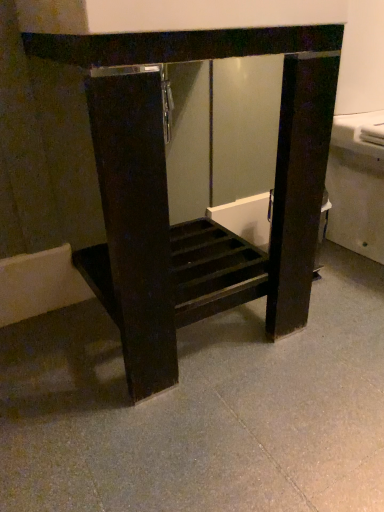
This screenshot has width=384, height=512. What do you see at coordinates (202, 410) in the screenshot?
I see `gray polished concrete at center` at bounding box center [202, 410].

Where is `gray polished concrete at center`? The height and width of the screenshot is (512, 384). gray polished concrete at center is located at coordinates (202, 410).

What is the approximate height of matte black cabinet at center?

It is 72.42 centimeters.

What do you see at coordinates (167, 192) in the screenshot?
I see `matte black cabinet at center` at bounding box center [167, 192].

Locate an element on the screen. This screenshot has height=512, width=384. matte black cabinet at center is located at coordinates (167, 192).

At what (x,y) coordinates should I click in order to perform the action: click on gray polished concrete at center. Please return your answer as a coordinate pair (x, y). This screenshot has width=384, height=512. Looking at the image, I should click on (202, 410).

Considering the relative positions of gray polished concrete at center and matte black cabinet at center in the image provided, is gray polished concrete at center to the right of matte black cabinet at center from the viewer's perspective?

Correct, you'll find gray polished concrete at center to the right of matte black cabinet at center.

Is the position of gray polished concrete at center more distant than that of matte black cabinet at center?

No, the depth of gray polished concrete at center is less than that of matte black cabinet at center.

Does point (248, 352) come farther from viewer compared to point (139, 358)?

Yes, point (248, 352) is behind point (139, 358).

From the image's perspective, is gray polished concrete at center located beneath matte black cabinet at center?

Yes, from the image's perspective, gray polished concrete at center is beneath matte black cabinet at center.

From a real-world perspective, is gray polished concrete at center physically above matte black cabinet at center?

Actually, gray polished concrete at center is physically below matte black cabinet at center in the real world.

Considering the sizes of objects gray polished concrete at center and matte black cabinet at center in the image provided, who is thinner, gray polished concrete at center or matte black cabinet at center?

matte black cabinet at center.

Based on the photo, considering the sizes of gray polished concrete at center and matte black cabinet at center in the image, is gray polished concrete at center taller or shorter than matte black cabinet at center?

Considering their sizes, gray polished concrete at center has less height than matte black cabinet at center.

Based on their sizes in the image, would you say gray polished concrete at center is bigger or smaller than matte black cabinet at center?

In the image, gray polished concrete at center appears to be smaller than matte black cabinet at center.

Is gray polished concrete at center situated inside matte black cabinet at center or outside?

gray polished concrete at center is located beyond the bounds of matte black cabinet at center.

Consider the image. Is gray polished concrete at center next to matte black cabinet at center?

They are not placed beside each other.

Is gray polished concrete at center oriented away from matte black cabinet at center?

No.

How far apart are gray polished concrete at center and matte black cabinet at center?

gray polished concrete at center is 10.55 inches from matte black cabinet at center.

Image resolution: width=384 pixels, height=512 pixels. I want to click on furniture on the left of gray polished concrete at center, so click(x=167, y=192).

Would you say matte black cabinet at center is to the left or to the right of gray polished concrete at center in the picture?

matte black cabinet at center is to the left of gray polished concrete at center.

Is matte black cabinet at center closer to the viewer compared to gray polished concrete at center?

No, matte black cabinet at center is further to the viewer.

Is point (291, 109) in front of point (235, 319)?

Yes.

From the image's perspective, who appears lower, matte black cabinet at center or gray polished concrete at center?

gray polished concrete at center appears lower in the image.

From a real-world perspective, is matte black cabinet at center physically above gray polished concrete at center?

Yes, from a real-world perspective, matte black cabinet at center is above gray polished concrete at center.

Does matte black cabinet at center have a lesser width compared to gray polished concrete at center?

Yes.

Between matte black cabinet at center and gray polished concrete at center, which one has more height?

With more height is matte black cabinet at center.

Consider the image. Considering the relative sizes of matte black cabinet at center and gray polished concrete at center in the image provided, is matte black cabinet at center smaller than gray polished concrete at center?

No.

Is gray polished concrete at center surrounded by matte black cabinet at center?

No, gray polished concrete at center is not a part of matte black cabinet at center.

Does matte black cabinet at center touch gray polished concrete at center?

No, matte black cabinet at center is not with gray polished concrete at center.

Could you tell me if matte black cabinet at center is turned towards gray polished concrete at center?

No, matte black cabinet at center is not facing towards gray polished concrete at center.

You are a GUI agent. You are given a task and a screenshot of the screen. Output one action in this format:
    pyautogui.click(x=<x>, y=<y>)
    Task: Click on the furniture above the gray polished concrete at center (from a real-world perspective)
    The image size is (384, 512).
    Given the screenshot: What is the action you would take?
    (x=167, y=192)

Locate an element on the screen. concrete that appears below the matte black cabinet at center (from a real-world perspective) is located at coordinates (202, 410).

Locate an element on the screen. Image resolution: width=384 pixels, height=512 pixels. concrete in front of the matte black cabinet at center is located at coordinates (202, 410).